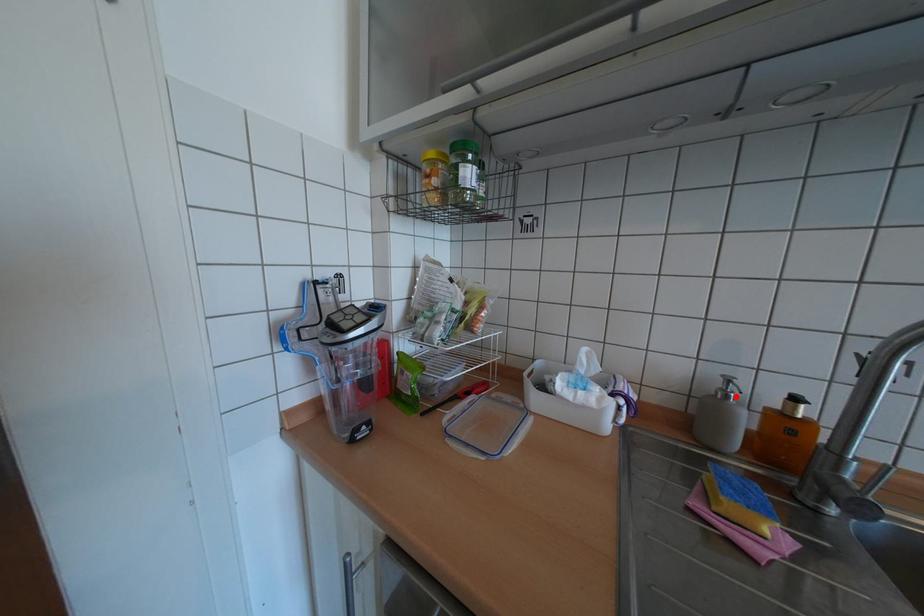
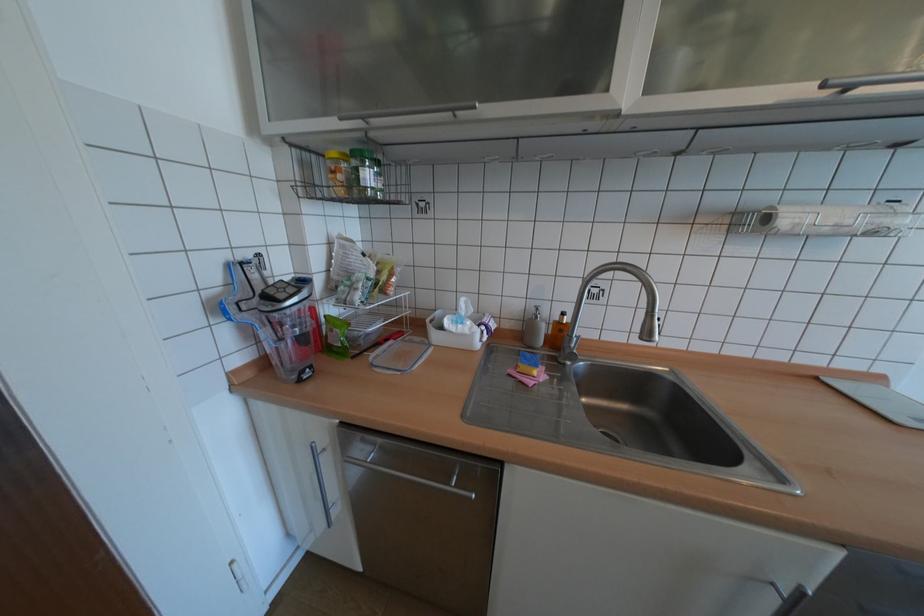
Locate, in the second image, the point that corresponds to the highlighted location in the first image.

(545, 317)